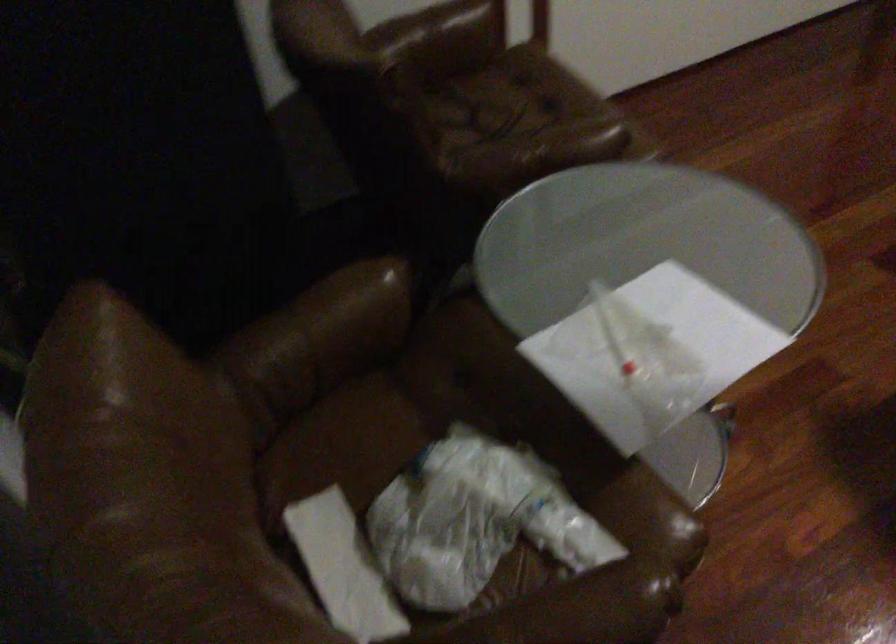
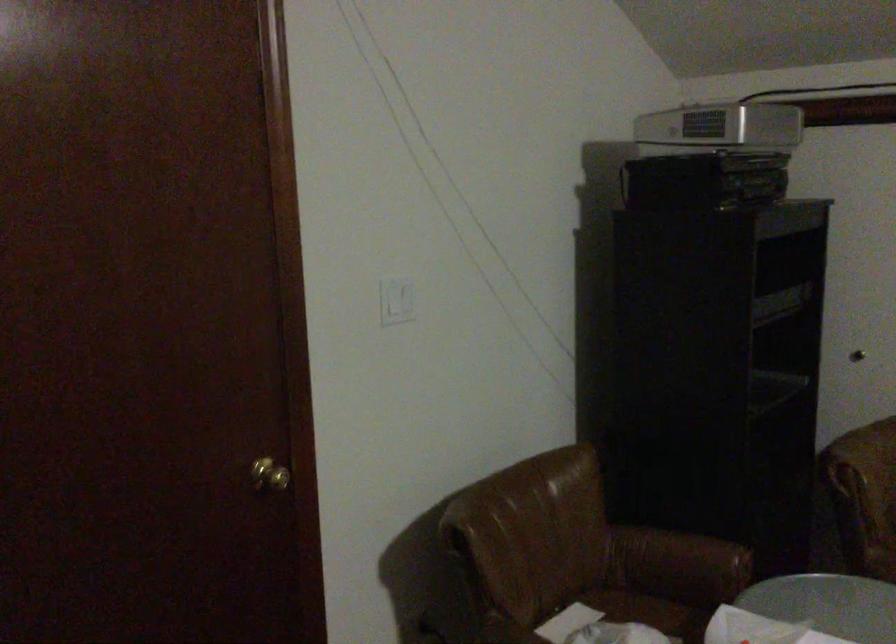
Where in the second image is the point corresponding to [326,332] from the first image?

(679, 559)